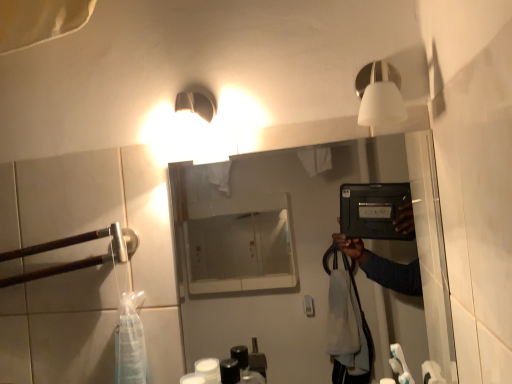
Question: Looking at the image, does brown wood at left seem bigger or smaller compared to matte black tablet at center?

Choices:
 (A) small
 (B) big

Answer: (A)

Question: Is brown wood at left taller or shorter than matte black tablet at center?

Choices:
 (A) short
 (B) tall

Answer: (A)

Question: Which object is the closest to the matte black tablet at center?

Choices:
 (A) brown wood at left
 (B) white matte light fixture at upper right

Answer: (A)

Question: Considering the real-world distances, which object is farthest from the brown wood at left?

Choices:
 (A) matte black tablet at center
 (B) white matte light fixture at upper right

Answer: (A)